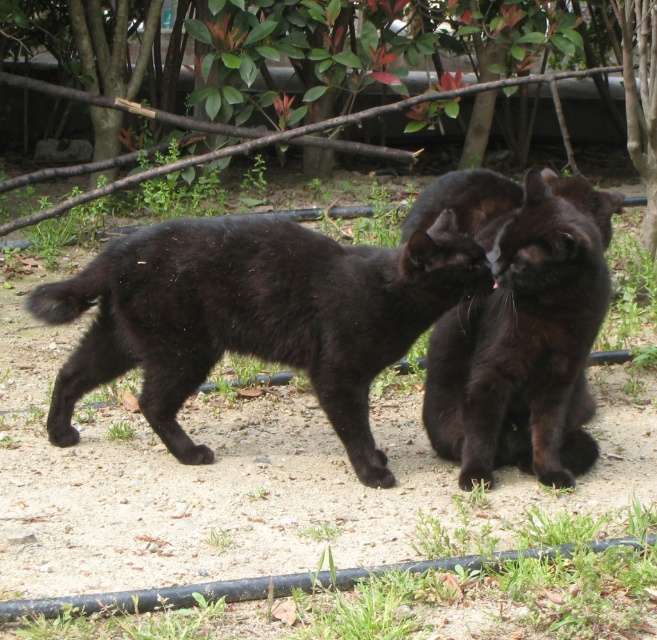
You are a photographer trying to capture a closeup of the matte black cat at center. You notice a point at coordinates (254, 316) in the frame. Where is this point located?

The point at coordinates (254, 316) is on the matte black cat at center.

You are a photographer trying to capture both points in the image. Which point, point (447, 307) or point (597, 259), is closer to the camera?

Point (447, 307) is further to the camera than point (597, 259), so point (597, 259) is closer to the camera.

You are a photographer trying to capture both the matte black cat at center and the shiny black cat at center in a single frame. The minimum distance your camera can focus on two subjects clearly is 20 inches. Based on the scene, will you be able to capture both cats clearly in one shot?

The matte black cat at center and the shiny black cat at center are 18.98 inches apart, which is less than the 20 inches minimum focusing distance required. Therefore, you will be able to capture both cats clearly in one shot.